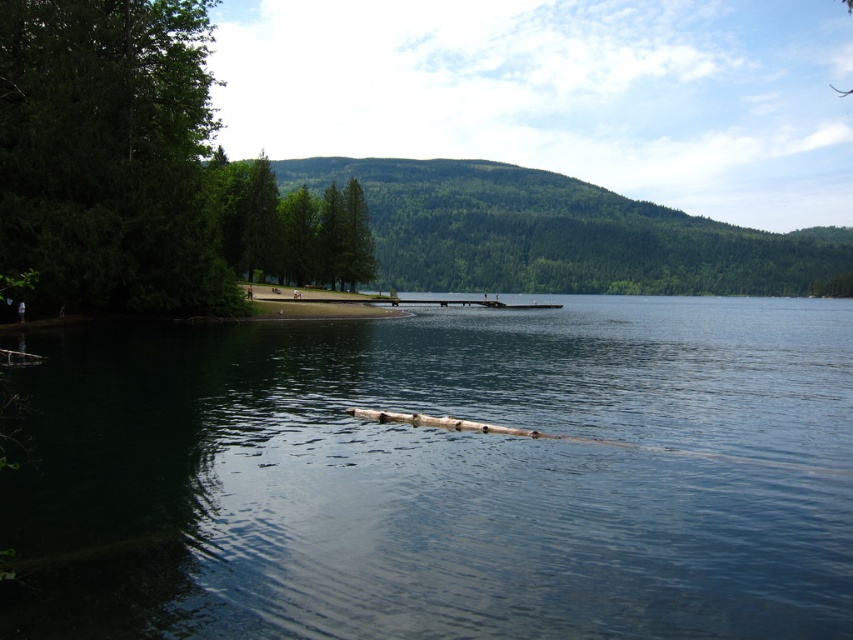
Question: Which is nearer to the clear water at center?

Choices:
 (A) green matte tree at center
 (B) green textured tree at center
 (C) green matte tree at left

Answer: (C)

Question: Which point is closer to the camera?

Choices:
 (A) (86, 269)
 (B) (509, 589)

Answer: (B)

Question: Does green matte tree at left come behind green matte tree at center?

Choices:
 (A) yes
 (B) no

Answer: (B)

Question: Which is farther from the green matte tree at center?

Choices:
 (A) green textured tree at center
 (B) clear water at center
 (C) green matte tree at left

Answer: (A)

Question: Does clear water at center appear over green textured tree at center?

Choices:
 (A) no
 (B) yes

Answer: (A)

Question: Does clear water at center come behind green textured tree at center?

Choices:
 (A) no
 (B) yes

Answer: (A)